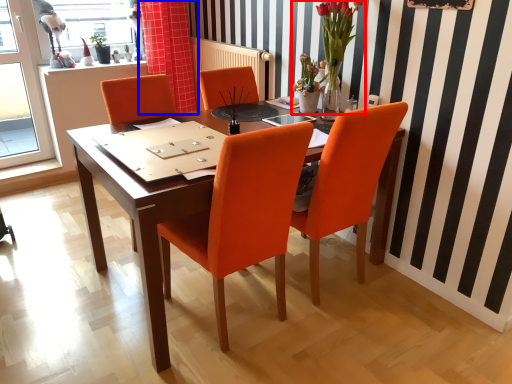
Question: Which of the following is the closest to the observer, floral arrangement (highlighted by a red box) or curtain (highlighted by a blue box)?

Choices:
 (A) floral arrangement
 (B) curtain

Answer: (A)